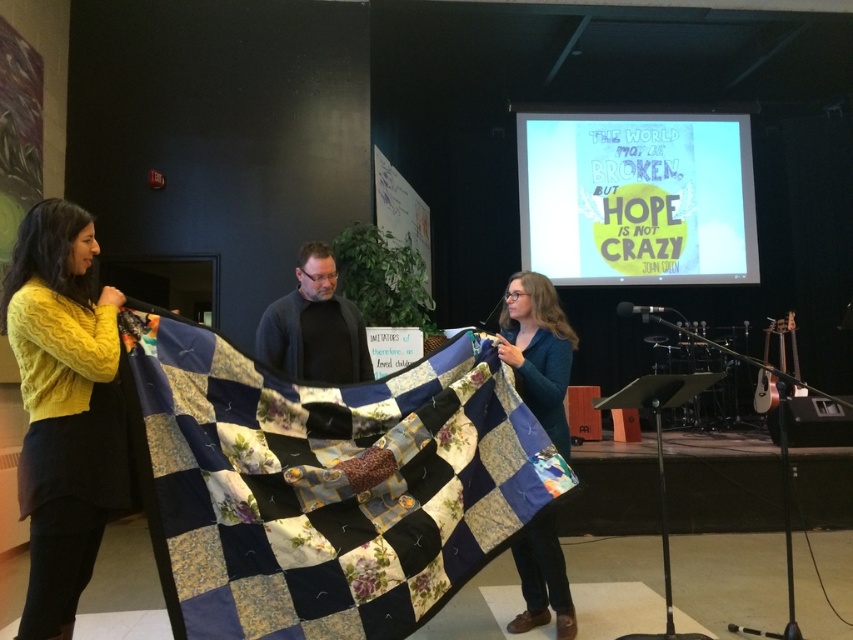
Question: Is cable-knit sweater at left bigger than dark gray sweater at center?

Choices:
 (A) yes
 (B) no

Answer: (A)

Question: Which point is closer to the camera taking this photo?

Choices:
 (A) (30, 392)
 (B) (502, 353)
 (C) (292, 548)
 (D) (352, 342)

Answer: (C)

Question: Is patchwork quilt at center thinner than dark gray sweater at center?

Choices:
 (A) no
 (B) yes

Answer: (A)

Question: Can you confirm if patchwork quilt at center is smaller than dark gray sweater at center?

Choices:
 (A) yes
 (B) no

Answer: (B)

Question: Which of the following is the closest to the observer?

Choices:
 (A) (97, 531)
 (B) (287, 316)
 (C) (546, 515)

Answer: (A)

Question: Among these points, which one is farthest from the camera?

Choices:
 (A) (544, 396)
 (B) (296, 301)

Answer: (B)